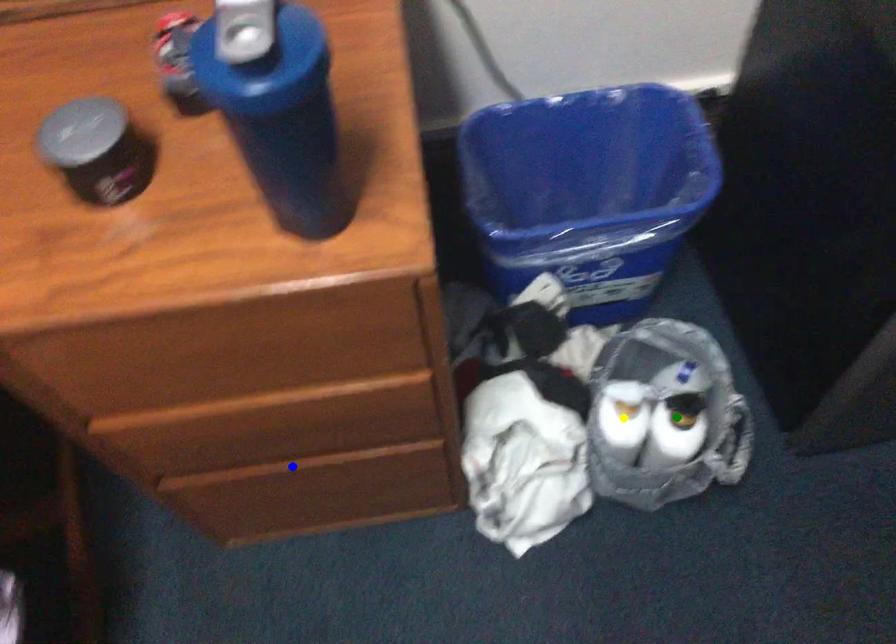
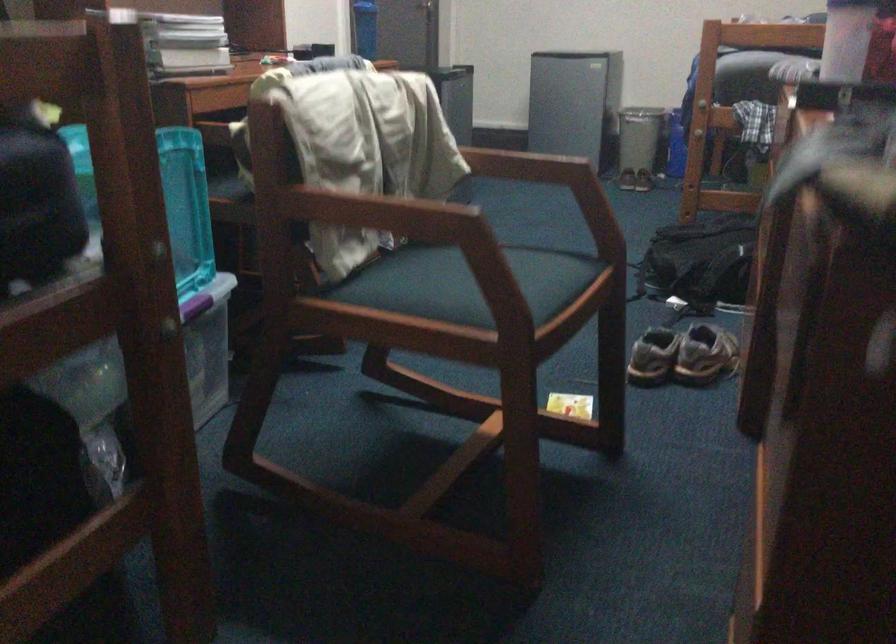
I am providing you with two images of the same scene from different viewpoints. Three points are marked in image1. Which point corresponds to a part or object that is occluded in image2?In image1, three points are marked. Which of them correspond to a part or object that is occluded in image2?Among the three points shown in image1, which one corresponds to a part or object that is no longer visible due to occlusion in image2?

blue point, green point, yellow point cannot be seen in image2.